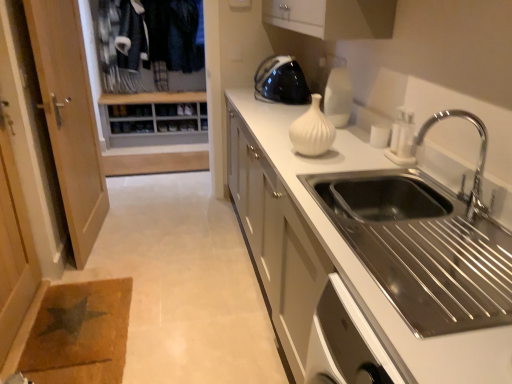
Question: From the image's perspective, relative to white matte countertop at center, is white glossy vase at upper center above or below?

Choices:
 (A) above
 (B) below

Answer: (A)

Question: Is white glossy vase at upper center bigger or smaller than white matte countertop at center?

Choices:
 (A) small
 (B) big

Answer: (A)

Question: Estimate the real-world distances between objects in this image. Which object is closer to the white glossy vase at upper center?

Choices:
 (A) white matte countertop at center
 (B) chrome metallic faucet at upper right
 (C) black glossy kettle at upper center
 (D) wooden screen door at left
 (E) white matte vase at center

Answer: (E)

Question: Considering the real-world distances, which object is closest to the white matte countertop at center?

Choices:
 (A) black glossy kettle at upper center
 (B) wooden shoe rack at upper left
 (C) stainless steel sink at right
 (D) white matte vase at center
 (E) wooden screen door at left

Answer: (D)